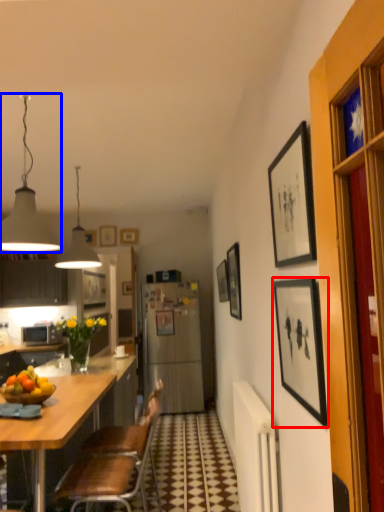
Question: Which point is further to the camera, picture frame (highlighted by a red box) or lamp (highlighted by a blue box)?

Choices:
 (A) picture frame
 (B) lamp

Answer: (B)